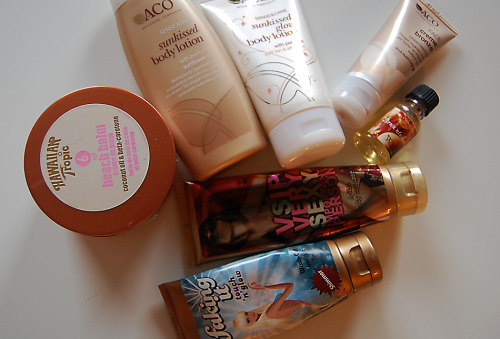
Find the location of a particular element. This screenshot has height=339, width=500. jar of balm is located at coordinates (127, 206).